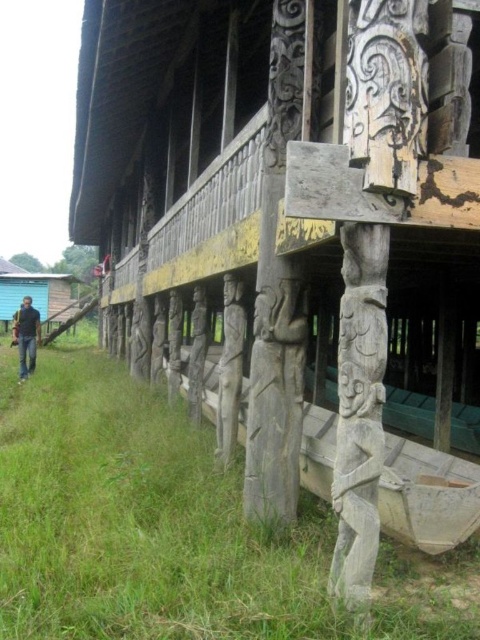
You are standing at the entrance of the longhouse and notice a specific point marked at coordinates (297, 230). Based on the scene description, what object or feature does this point most likely correspond to?

The point at coordinates (297, 230) corresponds to the weathered wood hut at lower center as described in the scene.

Consider the image. You are standing in front of the traditional wooden longhouse and notice two points marked on the pillars. The first point is at coordinates point (33, 506) and the second is at point (20, 339). Which of these points is nearer to you?

Point (33, 506) is closer to the viewer than point (20, 339).

You are an architect visiting this traditional wooden structure. You need to determine which object is taller between the wooden carving at center and the blue painted wood hut at lower left. Based on the scene, can you identify which one is taller?

The wooden carving at center is taller than the blue painted wood hut at lower left according to the description.